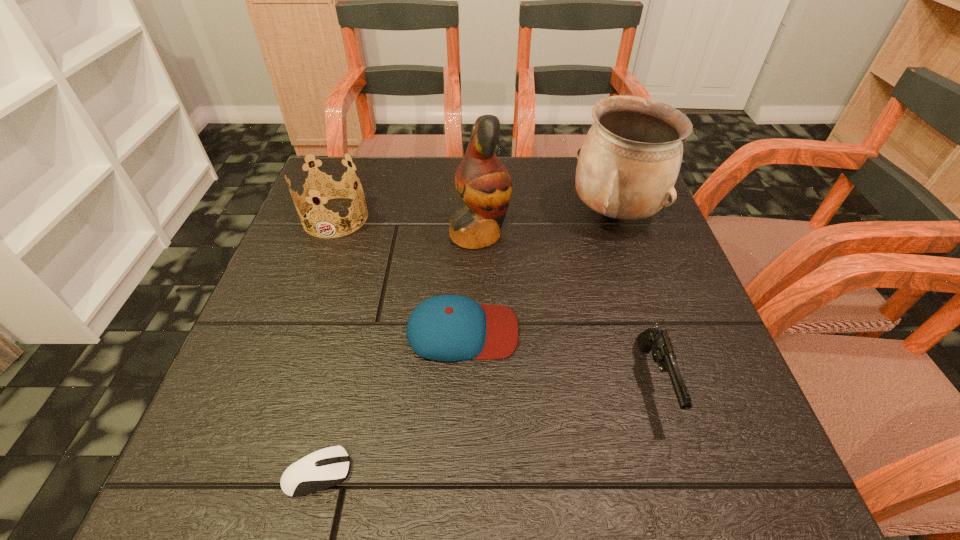
Identify the location of free spot between the fifth tallest object and the nearest object. The image size is (960, 540). (390, 402).

Where is `free space between the gun and the shortest object`? free space between the gun and the shortest object is located at coordinates (486, 427).

The image size is (960, 540). What are the coordinates of `vacant space in between the crown and the fifth tallest object` in the screenshot? It's located at (399, 274).

The width and height of the screenshot is (960, 540). I want to click on empty space that is in between the fourth shortest object and the fifth tallest object, so click(x=399, y=274).

Identify the location of empty space between the third shortest object and the urn. This screenshot has width=960, height=540. (635, 298).

What are the coordinates of `free spot between the mouse and the baseball cap` in the screenshot? It's located at (390, 402).

At what (x,y) coordinates should I click in order to perform the action: click on vacant point located between the second tallest object and the gun. Please return your answer as a coordinate pair (x, y). Looking at the image, I should click on (635, 298).

I want to click on vacant space that's between the fourth tallest object and the second shortest object, so click(x=559, y=356).

Locate an element on the screen. The height and width of the screenshot is (540, 960). object that is the fifth closest to the parrot is located at coordinates (321, 469).

Find the location of a particular element. This screenshot has height=540, width=960. object that is the fourth nearest to the mouse is located at coordinates (326, 187).